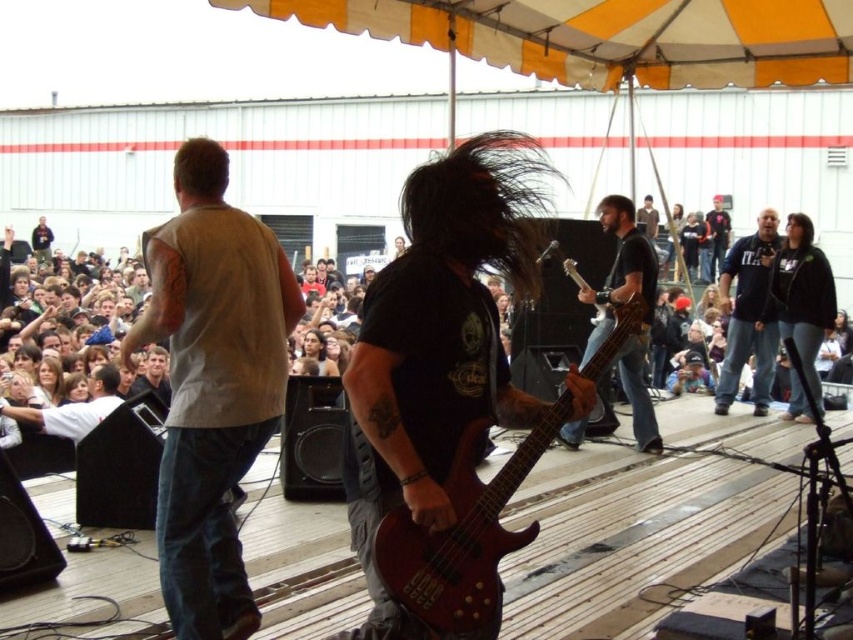
Who is lower down, dark blue jeans at center or dark gray shirt at center?

Positioned lower is dark gray shirt at center.

Who is more distant from viewer, (712,195) or (161,385)?

The point (712,195) is more distant.

At what (x,y) coordinates should I click in order to perform the action: click on dark blue jeans at center. Please return your answer as a coordinate pair (x, y). The image size is (853, 640). Looking at the image, I should click on (717, 236).

Who is more forward, [252,307] or [163,374]?

Positioned in front is point [252,307].

Is point (190, 296) positioned after point (161, 374)?

No, it is not.

You are a GUI agent. You are given a task and a screenshot of the screen. Output one action in this format:
    pyautogui.click(x=<x>, y=<y>)
    Task: Click on the light brown sleeveless shirt at left
    The width and height of the screenshot is (853, 640).
    Given the screenshot: What is the action you would take?
    [x=212, y=385]

Who is more distant from viewer, (462,570) or (712,252)?

Positioned behind is point (712,252).

Does point (506, 552) come behind point (727, 244)?

No.

Locate an element on the screen. The image size is (853, 640). mahogany wood bass at center is located at coordinates (462, 538).